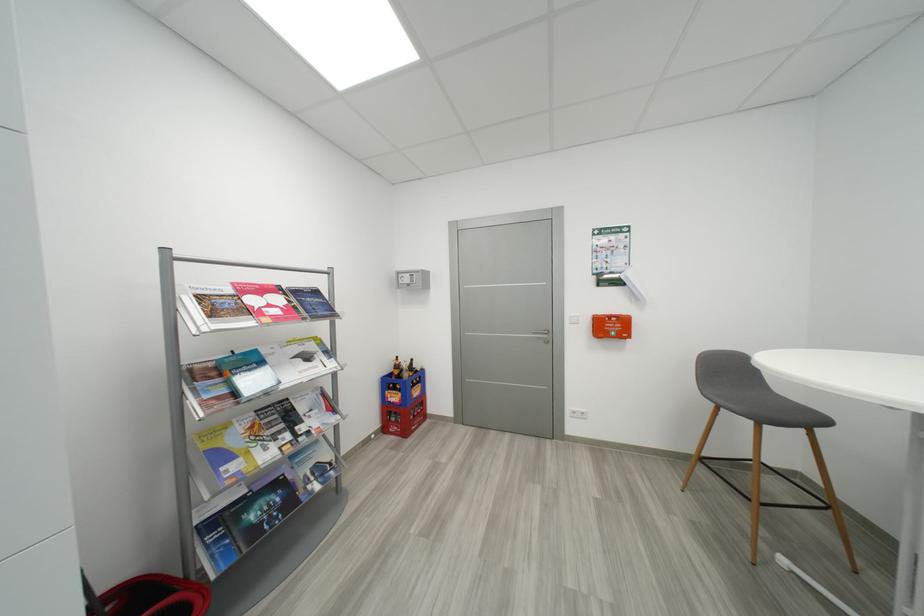
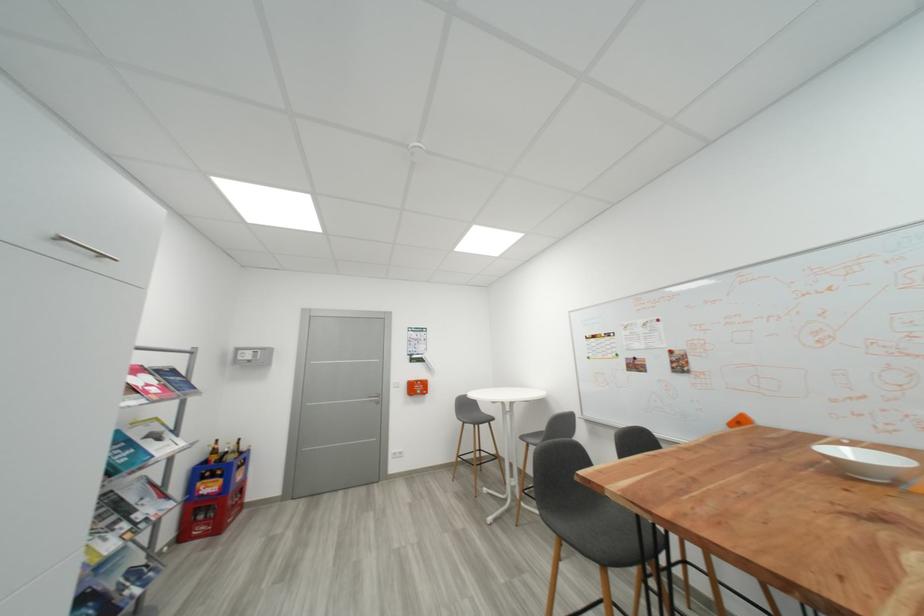
Find the pixel in the second image that matches point (392, 431) in the first image.

(189, 538)